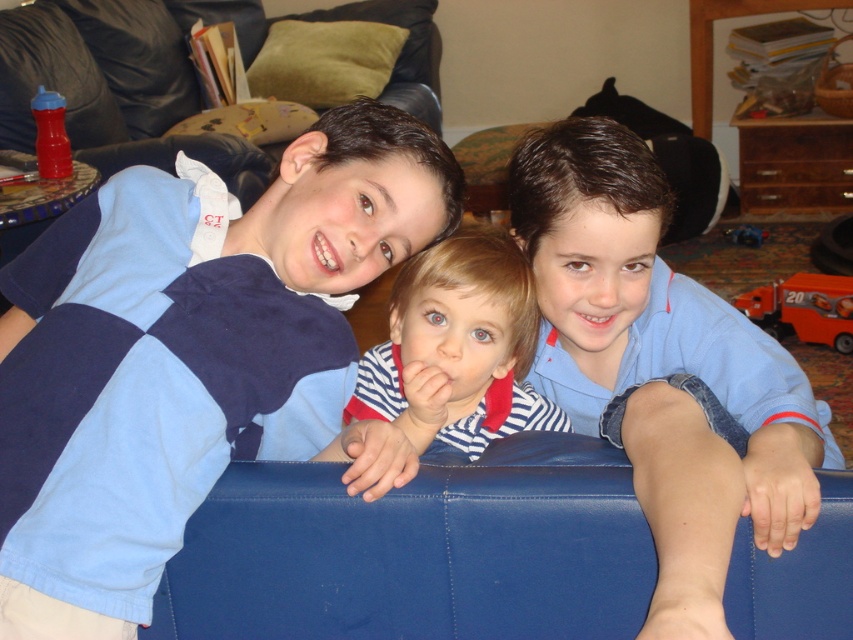
Question: Is orange plastic truck at lower right below blue plastic toy car at center?

Choices:
 (A) no
 (B) yes

Answer: (B)

Question: Can you confirm if blue denim jeans at lower right is bigger than striped fabric shirt at center?

Choices:
 (A) yes
 (B) no

Answer: (A)

Question: Which of the following is the closest to the observer?

Choices:
 (A) (842, 349)
 (B) (453, 244)

Answer: (B)

Question: Which point is farther from the camera taking this photo?

Choices:
 (A) tap(755, 230)
 (B) tap(785, 328)
 (C) tap(210, 356)

Answer: (A)

Question: Can you confirm if orange plastic truck at lower right is positioned to the left of rubberized red sippy cup at left?

Choices:
 (A) no
 (B) yes

Answer: (A)

Question: Among these points, which one is farthest from the camera?

Choices:
 (A) (827, 296)
 (B) (340, 131)
 (C) (523, 292)
 (D) (735, 243)

Answer: (D)